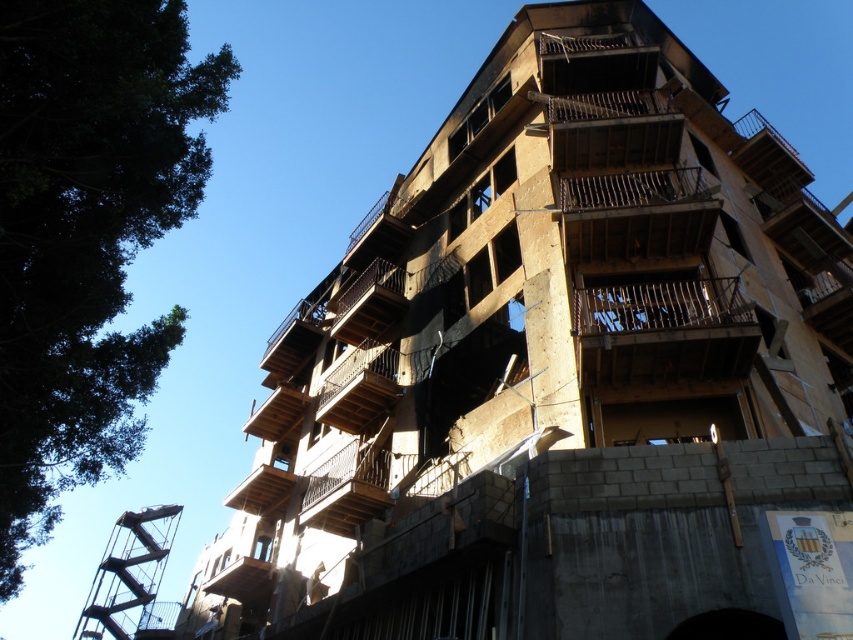
Question: Is rusty metal balcony at center above brown wooden balcony at center?

Choices:
 (A) no
 (B) yes

Answer: (B)

Question: Which object is closer to the camera taking this photo?

Choices:
 (A) rustic wood balcony at center
 (B) green leafy tree at upper left

Answer: (B)

Question: Is rustic wood balcony at center below brown wooden balcony at center?

Choices:
 (A) yes
 (B) no

Answer: (A)

Question: Which object appears closest to the camera in this image?

Choices:
 (A) green leafy tree at upper left
 (B) rusty metal balcony at center
 (C) rustic wood balcony at center
 (D) brown wooden balcony at center

Answer: (A)

Question: Does green leafy tree at upper left lie in front of rusty metal balcony at center?

Choices:
 (A) yes
 (B) no

Answer: (A)

Question: Which point is farther from the camera taking this photo?

Choices:
 (A) (347, 420)
 (B) (38, 452)
 (C) (335, 516)
 (D) (729, 310)

Answer: (A)